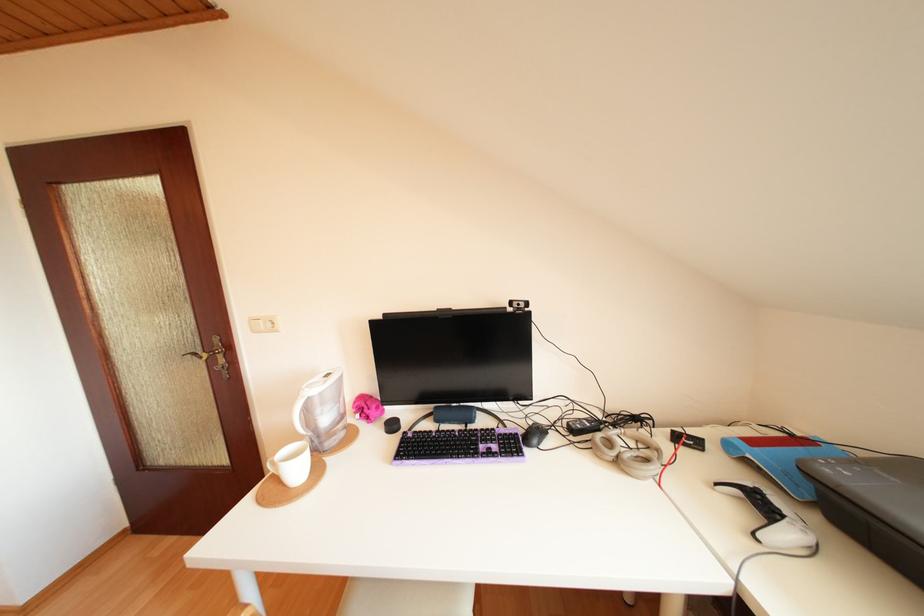
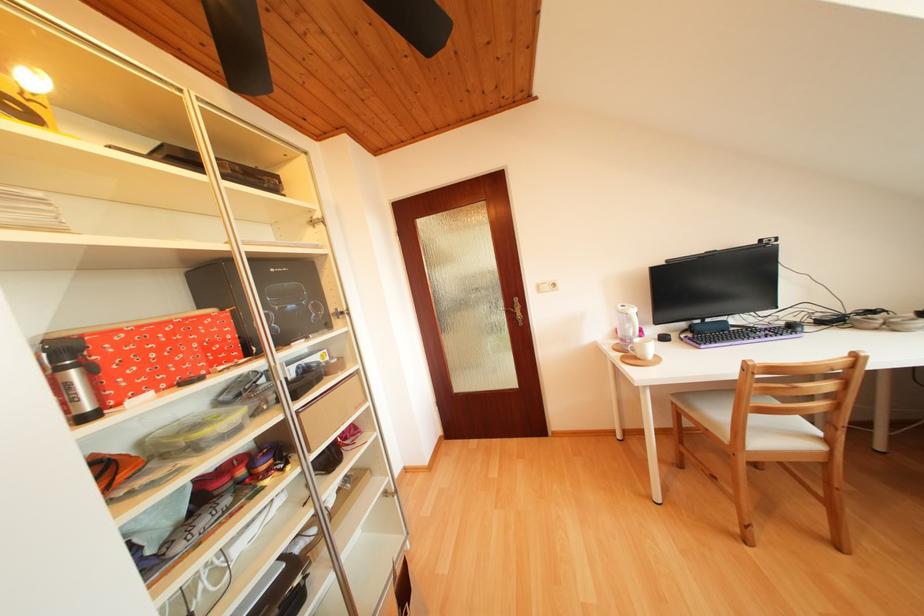
Locate, in the second image, the point that corresponds to (518,307) in the first image.

(769, 246)